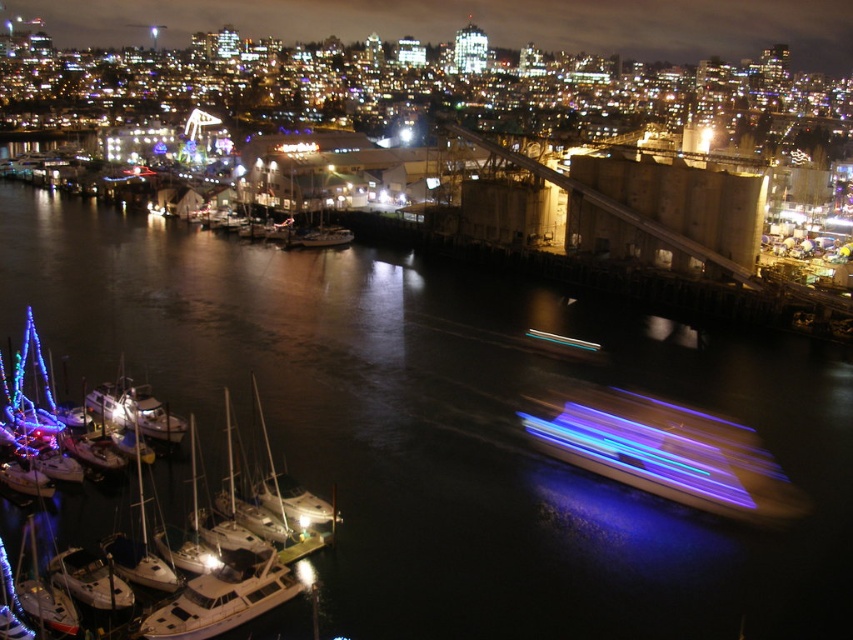
Question: Among these points, which one is farthest from the camera?

Choices:
 (A) (230, 573)
 (B) (531, 332)

Answer: (B)

Question: Does white matte boat at lower left have a larger size compared to metallic blue boat at center?

Choices:
 (A) no
 (B) yes

Answer: (A)

Question: Estimate the real-world distances between objects in this image. Which object is closer to the blue light trails at center?

Choices:
 (A) white matte sailboat at center
 (B) white matte sailboats at lower left

Answer: (B)

Question: Among these objects, which one is nearest to the camera?

Choices:
 (A) blue light trails at center
 (B) white matte sailboats at lower left
 (C) white matte boat at lower left
 (D) metallic blue boat at center

Answer: (B)

Question: Does white matte sailboats at lower left appear over metallic blue boat at center?

Choices:
 (A) yes
 (B) no

Answer: (B)

Question: Does metallic blue boat at center have a smaller size compared to white matte sailboat at center?

Choices:
 (A) yes
 (B) no

Answer: (A)